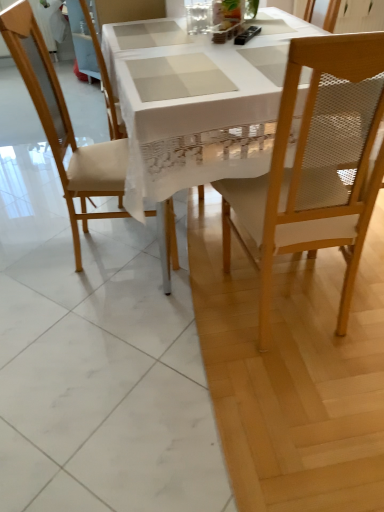
Locate an element on the screen. vacant area that lies in front of matte wood chair at left, which is the first chair from left to right is located at coordinates (117, 308).